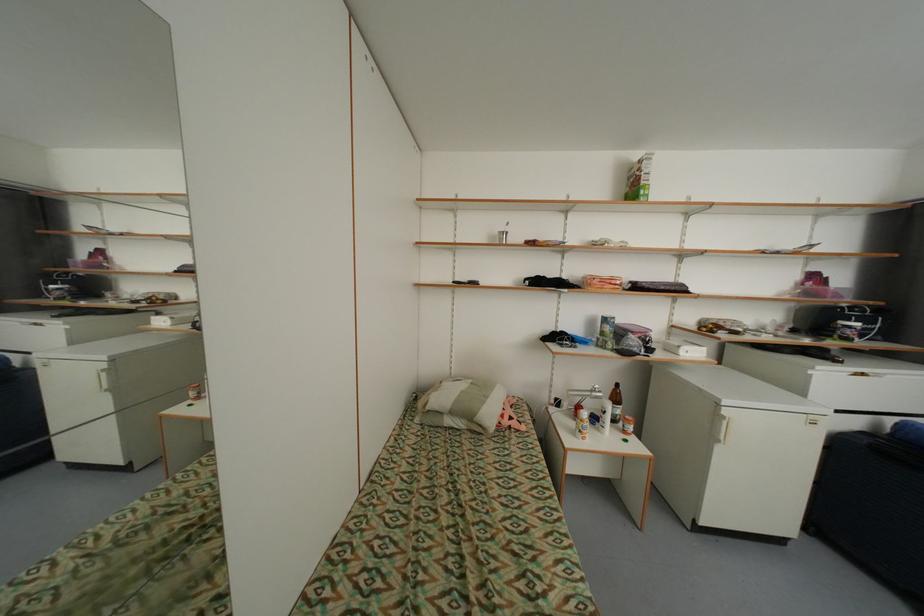
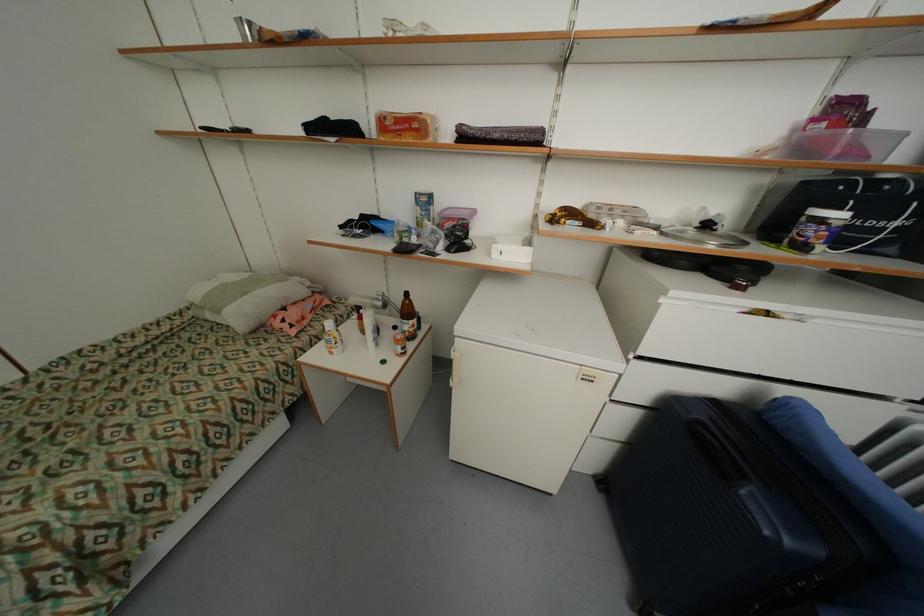
Locate, in the second image, the point that corresponds to (688,354) in the first image.

(502, 256)